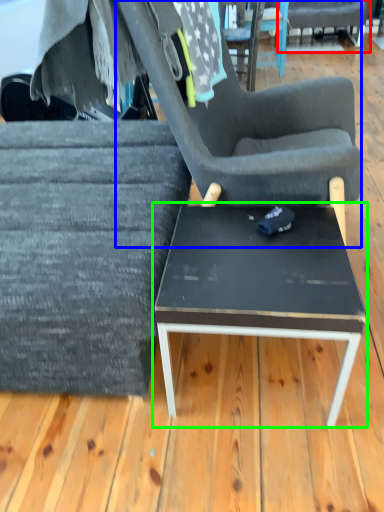
Question: Which object is the closest to the chair (highlighted by a red box)? Choose among these: chair (highlighted by a blue box) or coffee table (highlighted by a green box).

Choices:
 (A) chair
 (B) coffee table

Answer: (A)